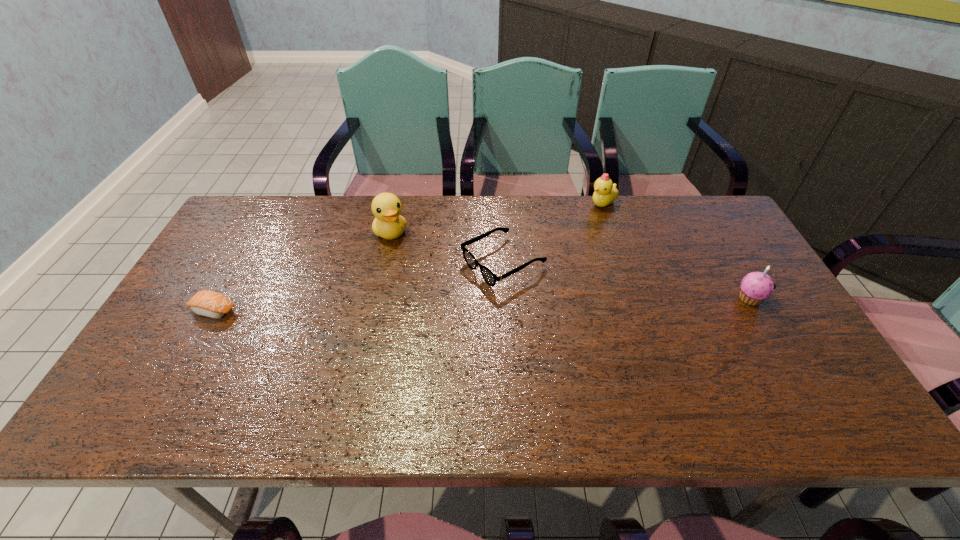
Where is `free spot on the desktop that is between the leftmost object and the cupcake and is positioned on the arms of the fourth tallest object`? free spot on the desktop that is between the leftmost object and the cupcake and is positioned on the arms of the fourth tallest object is located at coordinates (422, 306).

I want to click on vacant space on the desktop that is between the shortest object and the rightmost object and is positioned on the face of the duck, so click(429, 306).

At what (x,y) coordinates should I click in order to perform the action: click on vacant space on the desktop that is between the sushi and the rightmost object and is positioned on the front-facing side of the second object from right to left. Please return your answer as a coordinate pair (x, y). This screenshot has height=540, width=960. Looking at the image, I should click on (533, 303).